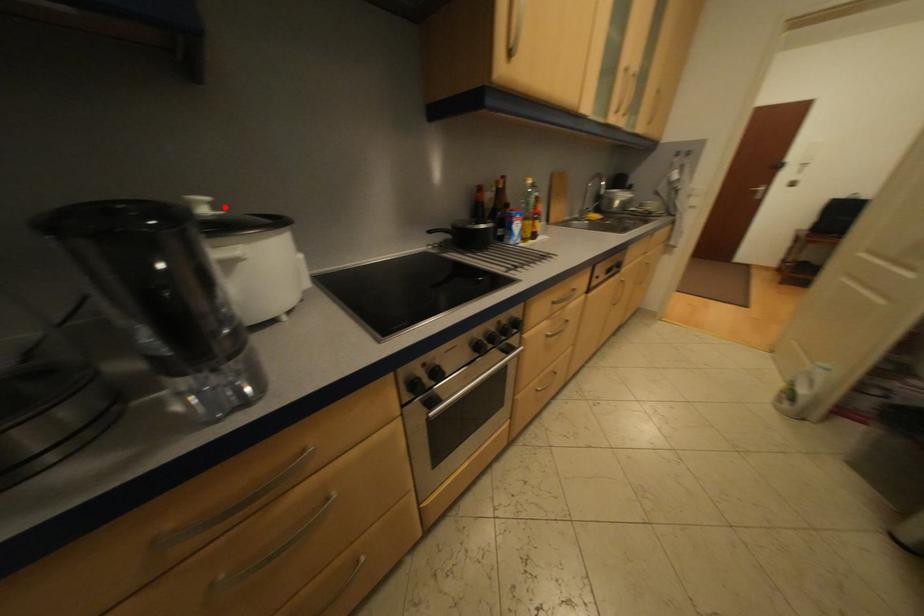
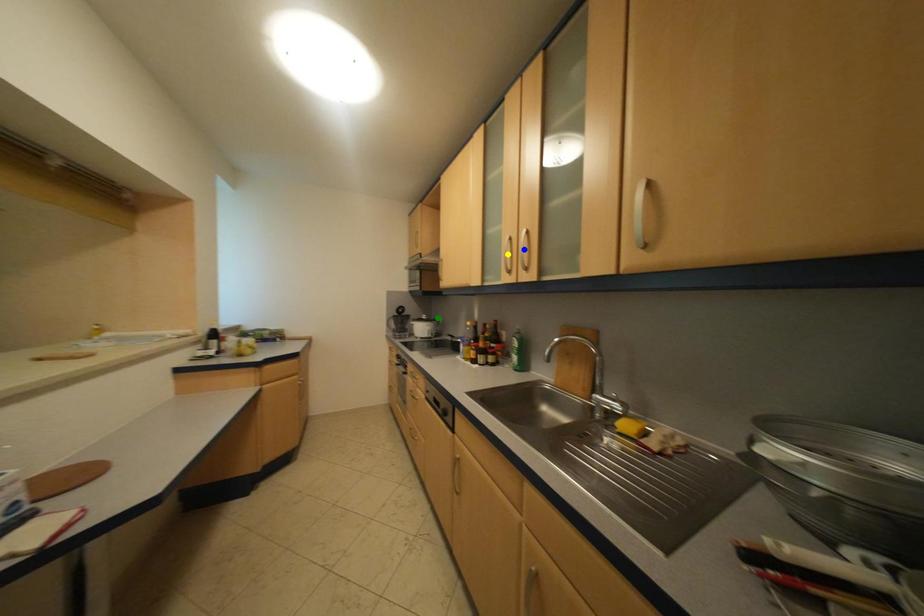
Question: I am providing you with two images of the same scene from different viewpoints. A red point is marked on the first image. You are given multiple points on the second image. Can you choose the point in image 2 that corresponds to the point in image 1?

Choices:
 (A) blue point
 (B) green point
 (C) yellow point

Answer: (B)